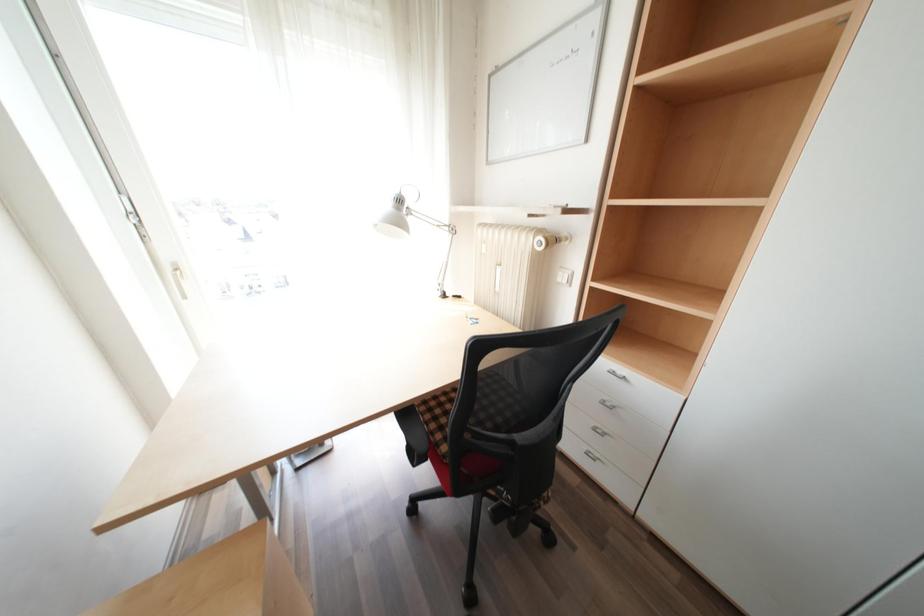
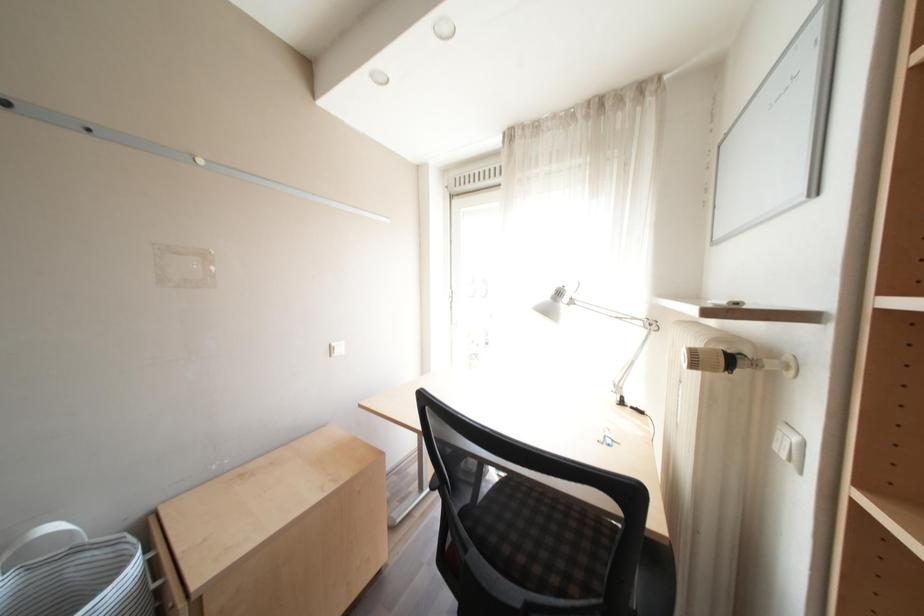
Question: How did the camera likely rotate?

Choices:
 (A) Left
 (B) Right
 (C) Up
 (D) Down

Answer: (A)